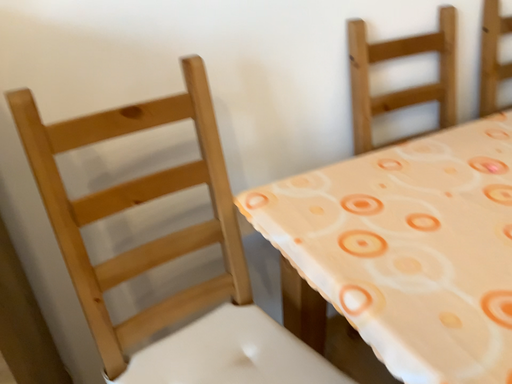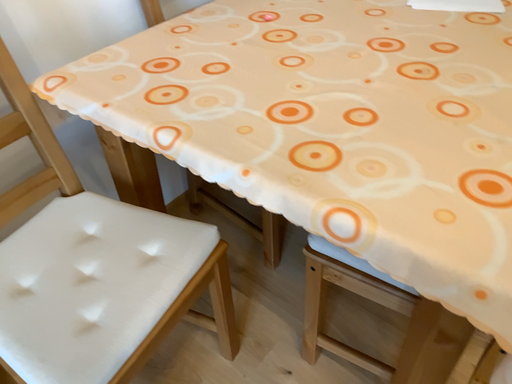
Question: Which way did the camera rotate in the video?

Choices:
 (A) rotated right
 (B) rotated left

Answer: (A)